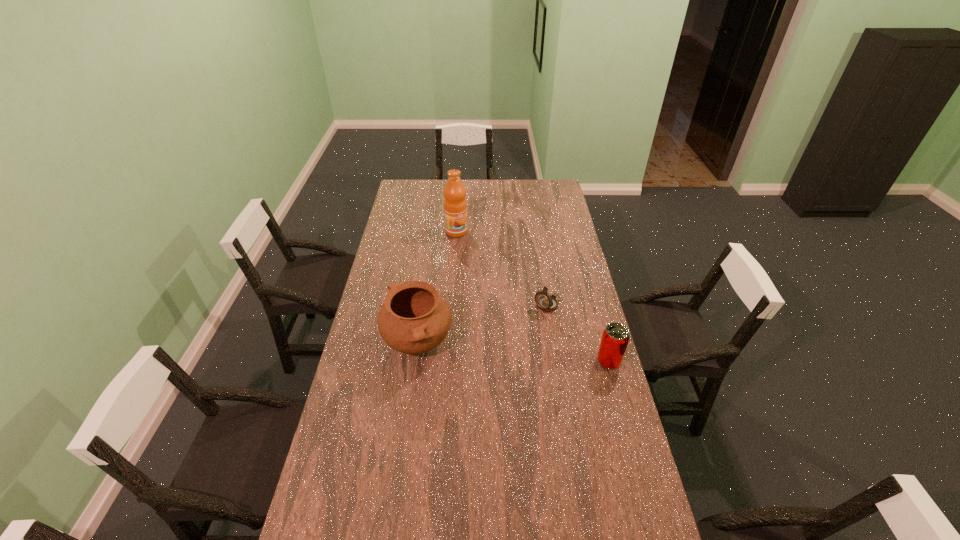
You are a GUI agent. You are given a task and a screenshot of the screen. Output one action in this format:
    pyautogui.click(x=<x>, y=<y>)
    Task: Click on the free space located 0.200m on the label side of the fruit juice
    The height and width of the screenshot is (540, 960).
    Given the screenshot: What is the action you would take?
    pyautogui.click(x=476, y=261)

The width and height of the screenshot is (960, 540). I want to click on free point located on the label side of the fruit juice, so click(x=481, y=269).

Where is `vacant area situated 0.100m on the face of the second farthest object`? The image size is (960, 540). vacant area situated 0.100m on the face of the second farthest object is located at coordinates (525, 327).

Locate an element on the screen. The height and width of the screenshot is (540, 960). vacant region located 0.370m on the face of the second farthest object is located at coordinates (480, 370).

This screenshot has height=540, width=960. What are the coordinates of `vacant space positioned 0.220m on the face of the second farthest object` in the screenshot? It's located at (506, 345).

Find the location of a particular element. The width and height of the screenshot is (960, 540). object present at the left edge is located at coordinates (414, 318).

This screenshot has width=960, height=540. What are the coordinates of `soda can situated at the right edge` in the screenshot? It's located at (615, 338).

Where is `compass present at the right edge`? The image size is (960, 540). compass present at the right edge is located at coordinates (546, 302).

In the image, there is a desktop. Identify the location of vacant region at the far edge. The width and height of the screenshot is (960, 540). (526, 188).

Find the location of a particular element. The image size is (960, 540). vacant position at the left edge of the desktop is located at coordinates (402, 222).